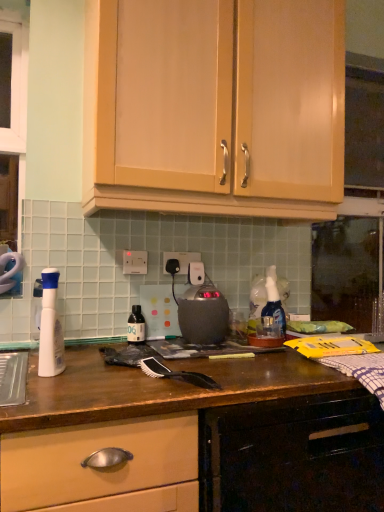
Question: In terms of height, does satin black kettle at center look taller or shorter compared to black plastic electric outlet at center, which is the second electric outlet in left-to-right order?

Choices:
 (A) short
 (B) tall

Answer: (B)

Question: In terms of width, does satin black kettle at center look wider or thinner when compared to black plastic electric outlet at center, which is the first electric outlet from back to front?

Choices:
 (A) wide
 (B) thin

Answer: (A)

Question: Which is nearer to the wooden drawer at lower left, the 1th cabinetry when ordered from bottom to top?

Choices:
 (A) white plastic spray bottle at left
 (B) white plastic electric outlet at center, the 1th electric outlet viewed from the front
 (C) translucent plastic bottle at center
 (D) black synthetic brush at center
 (E) satin black kettle at center

Answer: (D)

Question: Which object is positioned closest to the translucent plastic bottle at center?

Choices:
 (A) white plastic spray bottle at left
 (B) black plastic electric outlet at center, which appears as the 1th electric outlet when viewed from the right
 (C) wooden drawer at lower left, the 1th cabinetry when ordered from bottom to top
 (D) black synthetic brush at center
 (E) matte wood cabinets at upper center, the 2th cabinetry when ordered from bottom to top

Answer: (B)